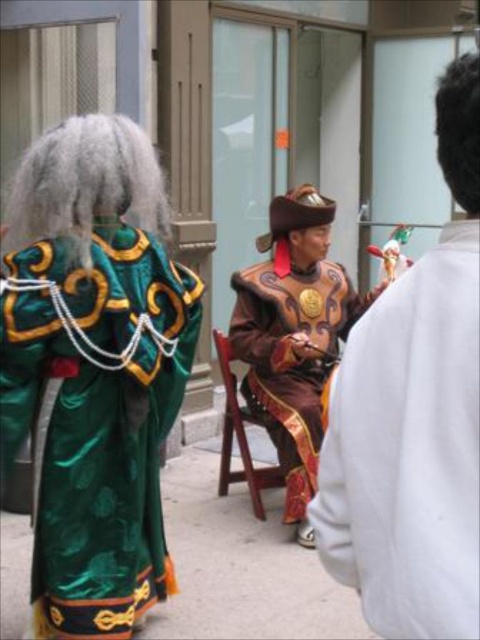
Based on the photo, is green satin robe at left wider than wooden at center?

Yes.

Where is `green satin robe at left`? The height and width of the screenshot is (640, 480). green satin robe at left is located at coordinates (94, 369).

Which is behind, point (36, 513) or point (222, 346)?

The point (222, 346) is more distant.

The height and width of the screenshot is (640, 480). In order to click on green satin robe at left in this screenshot , I will do `click(94, 369)`.

How far apart are shiny brown leather hat at center and brown satin costume at center?

shiny brown leather hat at center and brown satin costume at center are 2.66 meters apart from each other.

Does shiny brown leather hat at center have a larger size compared to brown satin costume at center?

Actually, shiny brown leather hat at center might be smaller than brown satin costume at center.

This screenshot has height=640, width=480. In order to click on shiny brown leather hat at center in this screenshot , I will do `click(414, 417)`.

Image resolution: width=480 pixels, height=640 pixels. In order to click on shiny brown leather hat at center in this screenshot , I will do `click(414, 417)`.

Who is positioned more to the right, green satin robe at left or shiny brown leather hat at center?

shiny brown leather hat at center

This screenshot has height=640, width=480. I want to click on green satin robe at left, so click(x=94, y=369).